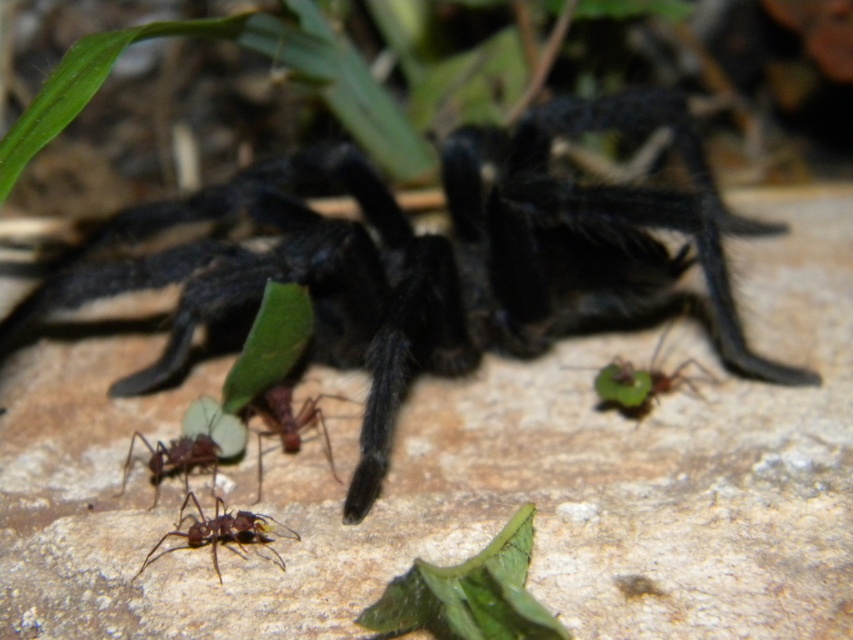
Question: Is green leafy plant at upper center smaller than green matte leaf at lower right?

Choices:
 (A) no
 (B) yes

Answer: (A)

Question: Which point is farther to the camera?

Choices:
 (A) (216, 508)
 (B) (209, 435)
 (C) (505, 612)
 (D) (352, 314)

Answer: (D)

Question: Among these points, which one is farthest from the camera?

Choices:
 (A) (189, 461)
 (B) (662, 369)
 (C) (73, 61)

Answer: (B)

Question: Considering the relative positions of green matte leaf at lower right and brown matte ant at lower center in the image provided, where is green matte leaf at lower right located with respect to brown matte ant at lower center?

Choices:
 (A) above
 (B) below

Answer: (A)

Question: Which of the following is the farthest from the observer?

Choices:
 (A) brown matte ant at lower center
 (B) green matte leaf at lower right

Answer: (B)

Question: Is black fuzzy spider at center positioned at the back of brown matte ant at center?

Choices:
 (A) yes
 (B) no

Answer: (B)